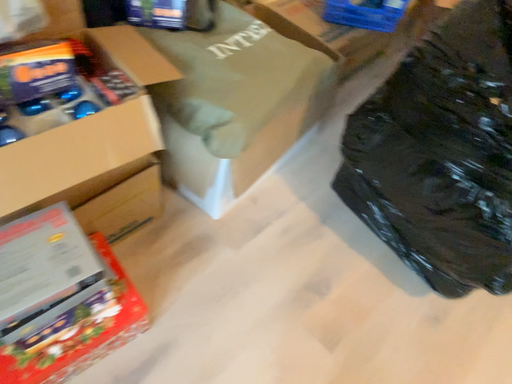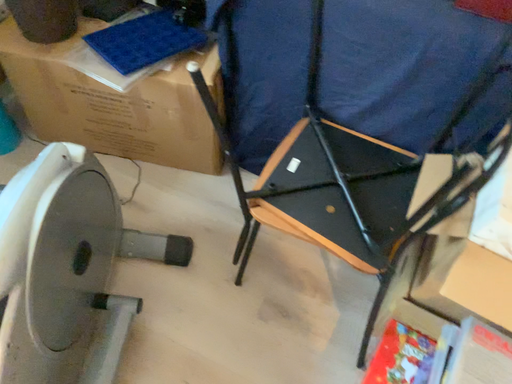
Question: Which way did the camera rotate in the video?

Choices:
 (A) rotated upward
 (B) rotated downward

Answer: (A)